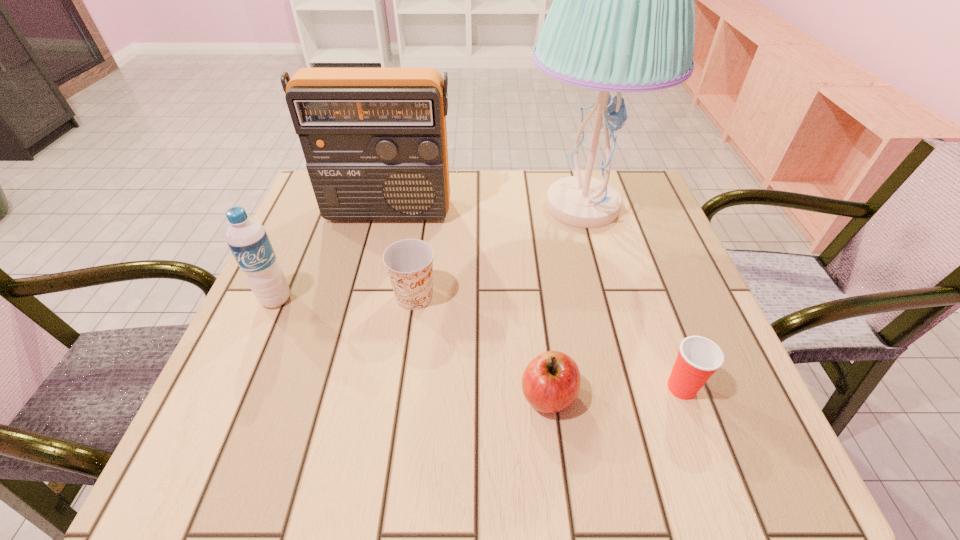
Locate an element on the screen. This screenshot has width=960, height=540. free area in between the water bottle and the second tallest object is located at coordinates (332, 255).

In order to click on empty space between the tallest object and the right Dixie cup in this screenshot , I will do `click(632, 297)`.

Where is `vacant area between the apple and the nearer Dixie cup`? The width and height of the screenshot is (960, 540). vacant area between the apple and the nearer Dixie cup is located at coordinates (614, 392).

This screenshot has width=960, height=540. In order to click on vacant region between the right Dixie cup and the apple in this screenshot , I will do `click(614, 392)`.

Image resolution: width=960 pixels, height=540 pixels. Find the location of `free space between the fourth shortest object and the farther Dixie cup`. free space between the fourth shortest object and the farther Dixie cup is located at coordinates (346, 298).

You are a GUI agent. You are given a task and a screenshot of the screen. Output one action in this format:
    pyautogui.click(x=<x>, y=<y>)
    Task: Click on the free space between the right Dixie cup and the tallest object
    This screenshot has height=540, width=960.
    Given the screenshot: What is the action you would take?
    pyautogui.click(x=632, y=297)

Identify the location of object that can be found as the fifth closest to the tallest object. Image resolution: width=960 pixels, height=540 pixels. (247, 239).

Locate an element on the screen. This screenshot has height=540, width=960. object that stands as the second closest to the radio receiver is located at coordinates (409, 262).

This screenshot has height=540, width=960. Find the location of `free space that satisfies the following two spatial constraints: 1. on the label of the fourth shortest object; 2. on the right side of the nearer Dixie cup`. free space that satisfies the following two spatial constraints: 1. on the label of the fourth shortest object; 2. on the right side of the nearer Dixie cup is located at coordinates (237, 388).

This screenshot has width=960, height=540. What are the coordinates of `free location that satisfies the following two spatial constraints: 1. on the front-facing side of the radio receiver; 2. on the right side of the nearer Dixie cup` in the screenshot? It's located at (345, 388).